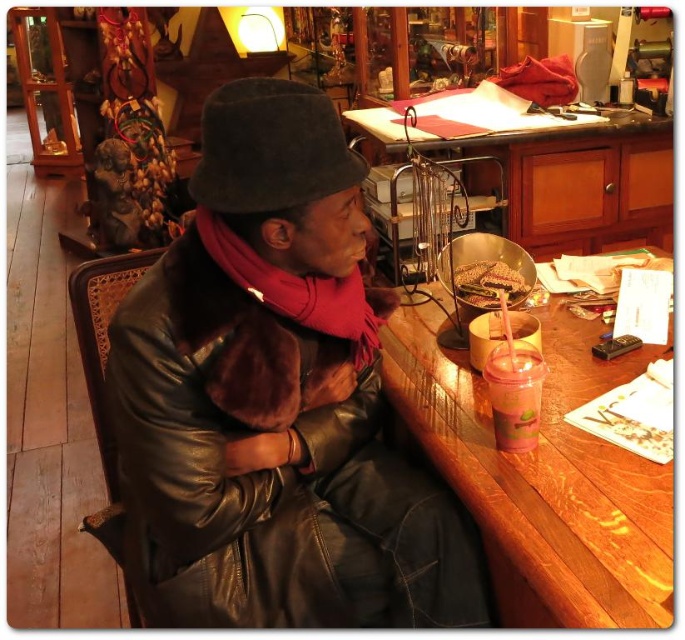
Question: Can you confirm if wooden table at right is positioned below wooden table at upper center?

Choices:
 (A) yes
 (B) no

Answer: (A)

Question: Considering the relative positions of wooden table at right and felt hat at upper left in the image provided, where is wooden table at right located with respect to felt hat at upper left?

Choices:
 (A) below
 (B) above

Answer: (A)

Question: Among these points, which one is nearest to the camera?

Choices:
 (A) coord(584,323)
 (B) coord(499,385)
 (C) coord(282,554)
 (D) coord(282,92)

Answer: (D)

Question: Which of the following is the farthest from the observer?

Choices:
 (A) (242, 120)
 (B) (480, 428)

Answer: (B)

Question: Does wooden table at right come behind translucent plastic cup at right?

Choices:
 (A) yes
 (B) no

Answer: (B)

Question: Which point is closer to the camera?

Choices:
 (A) (525, 404)
 (B) (427, 515)
 (C) (386, 378)
 (D) (595, 216)

Answer: (A)